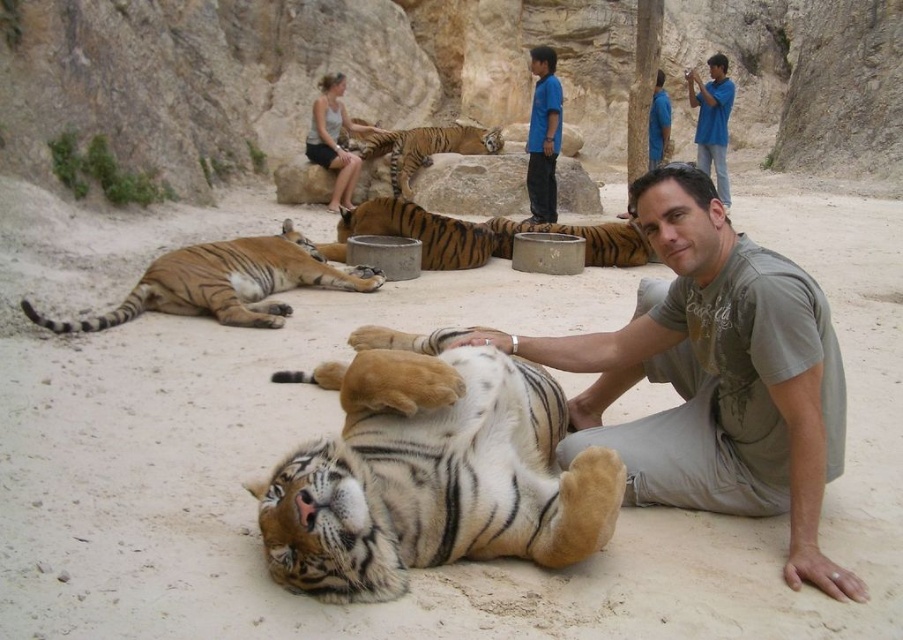
You are a visitor standing at the entrance of the sanctuary and see the orange fur tiger at center. The sanctuary has a safety rule that visitors must stay at least 10 meters away from the tigers. Are you following the safety rule?

The distance between you and the orange fur tiger at center is 15.84 meters, which is more than the required 10 meters, so you are following the safety rule.

You are a zookeeper observing the tigers in the sanctuary. You notice the orange fur tiger at center and the orange fur tiger at upper center. Which tiger do you think is younger based on their sizes?

The orange fur tiger at center is smaller in size compared to the orange fur tiger at upper center. Since younger tigers are typically smaller, the orange fur tiger at center is likely the younger one.